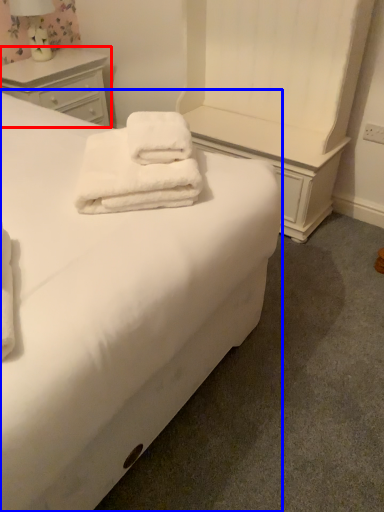
Question: Which of the following is the farthest to the observer, chest of drawers (highlighted by a red box) or bed (highlighted by a blue box)?

Choices:
 (A) chest of drawers
 (B) bed

Answer: (A)